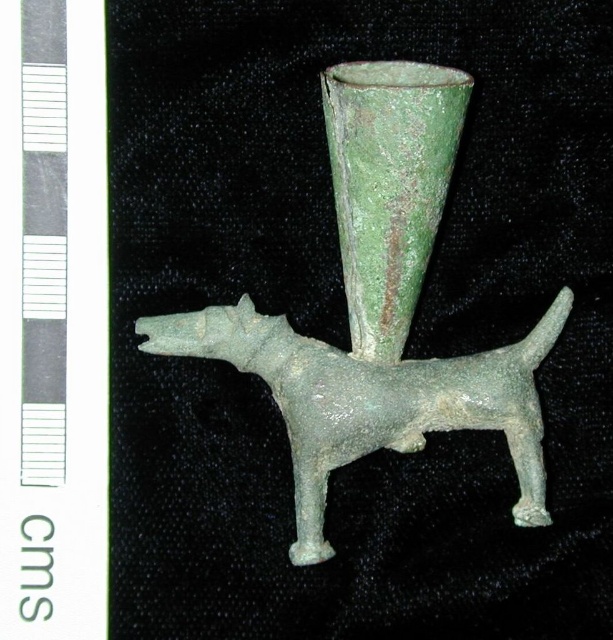
Question: Which point appears closest to the camera in this image?

Choices:
 (A) coord(300,528)
 (B) coord(340,157)

Answer: (B)

Question: Is green patinated metal dog at center below green patinated glass vase at center?

Choices:
 (A) yes
 (B) no

Answer: (A)

Question: Where is green patinated metal dog at center located in relation to green patinated glass vase at center in the image?

Choices:
 (A) left
 (B) right

Answer: (A)

Question: Can you confirm if green patinated metal dog at center is positioned to the left of green patinated glass vase at center?

Choices:
 (A) yes
 (B) no

Answer: (A)

Question: Which point is farther to the camera?

Choices:
 (A) (310, 424)
 (B) (386, 108)

Answer: (A)